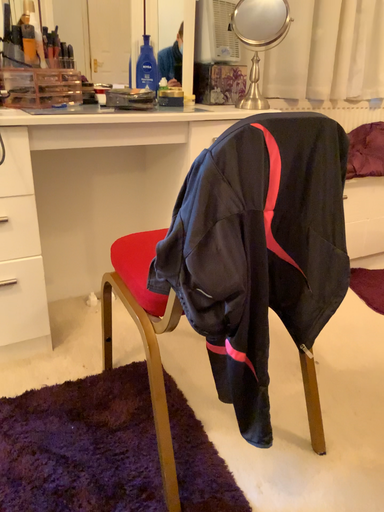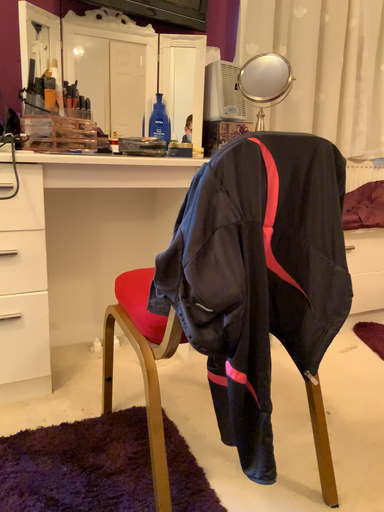
Question: How did the camera likely rotate when shooting the video?

Choices:
 (A) rotated downward
 (B) rotated upward

Answer: (B)